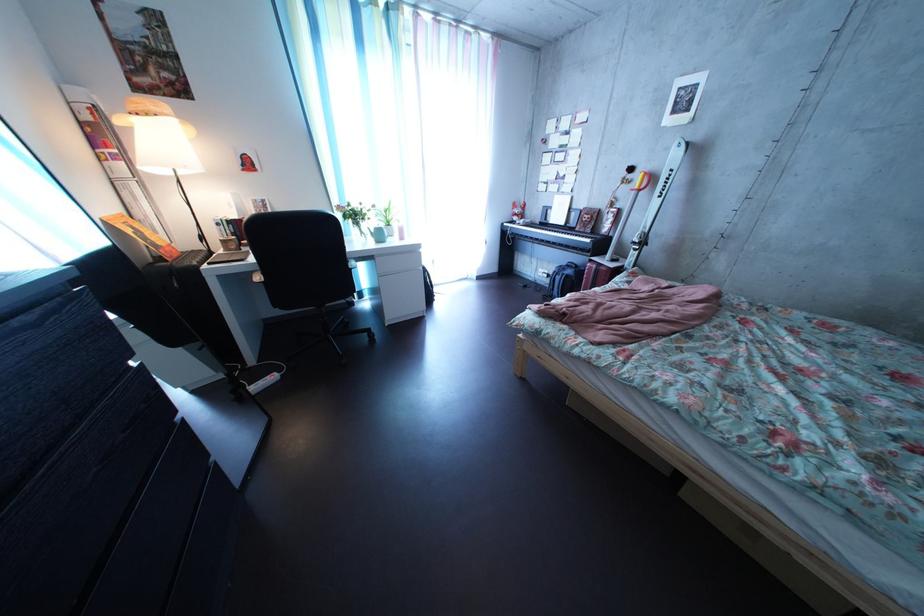
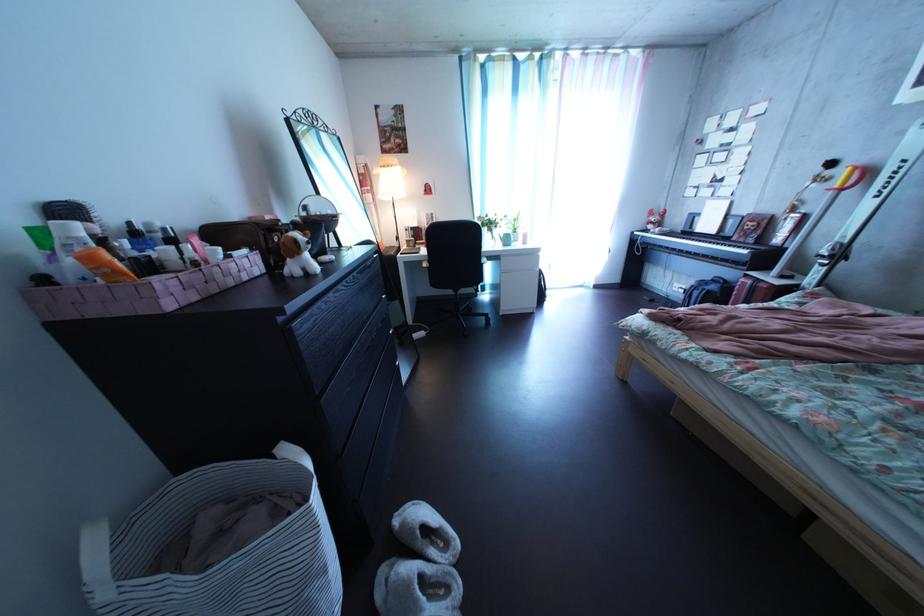
Question: In a continuous first-person perspective shot, in which direction is the camera moving?

Choices:
 (A) Left
 (B) Right
 (C) Forward
 (D) Backward

Answer: (D)